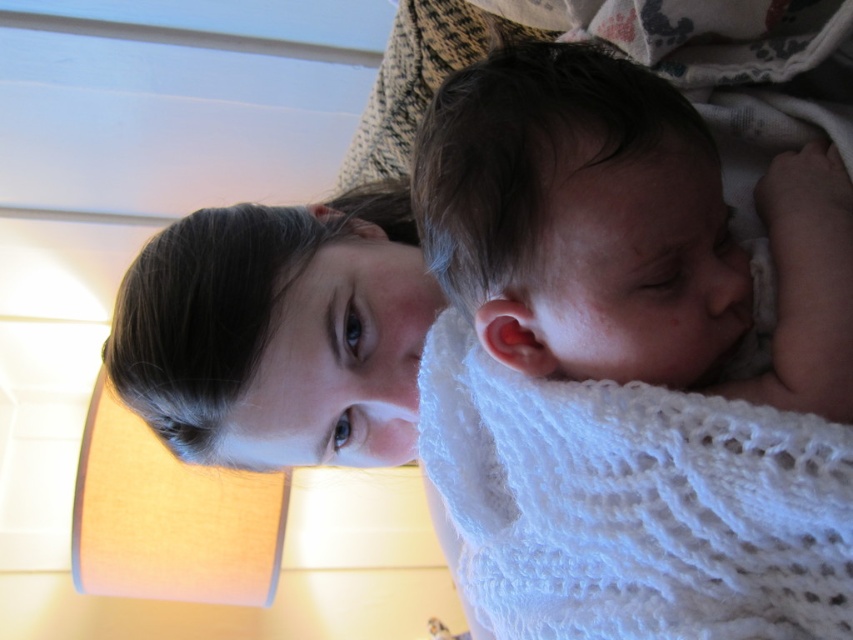
You are a photographer setting up for a portrait. You notice the smooth white swaddling at right and the smooth skin face at upper center in the scene. Which object is covering part of the other?

The smooth white swaddling at right is positioned over the smooth skin face at upper center, so it is covering part of it.